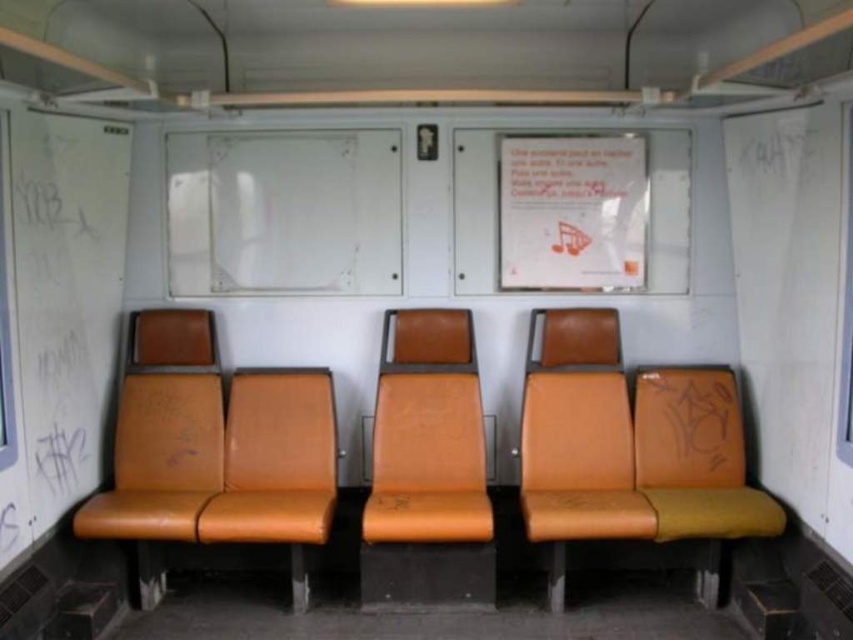
Does white paper poster at upper center have a greater height compared to orange leather seat at left?

In fact, white paper poster at upper center may be shorter than orange leather seat at left.

At what (x,y) coordinates should I click in order to perform the action: click on white paper poster at upper center. Please return your answer as a coordinate pair (x, y). This screenshot has width=853, height=640. Looking at the image, I should click on (572, 212).

Identify the location of white paper poster at upper center. (572, 212).

Which is above, orange leather chair at center or leather-like orange seat at center?

orange leather chair at center

Is point (401, 396) more distant than point (581, 515)?

Yes.

Identify the location of orange leather chair at center. The height and width of the screenshot is (640, 853). (427, 468).

Between orange leather chair at center and leather-like orange seat at right, which one appears on the left side from the viewer's perspective?

orange leather chair at center is more to the left.

The image size is (853, 640). Find the location of `orange leather chair at center`. orange leather chair at center is located at coordinates (427, 468).

Locate an element on the screen. orange leather chair at center is located at coordinates (427, 468).